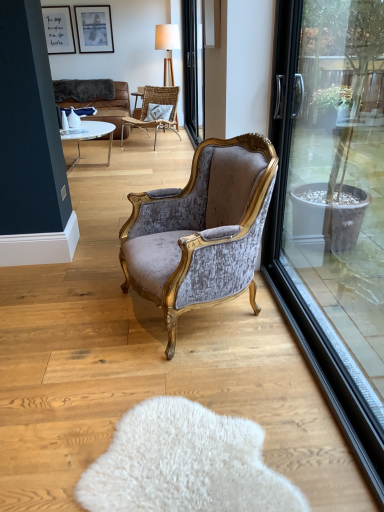
Question: Visually, is matte black picture frame at upper center, the 1th picture frame in the right-to-left sequence, positioned to the left or to the right of white glossy vase at upper left, acting as the second vase starting from the back?

Choices:
 (A) right
 (B) left

Answer: (B)

Question: Is matte black picture frame at upper center, the 1th picture frame in the right-to-left sequence, inside the boundaries of white glossy vase at upper left, acting as the second vase starting from the back, or outside?

Choices:
 (A) inside
 (B) outside

Answer: (B)

Question: Estimate the real-world distances between objects in this image. Which object is farther from the white glossy vase at center, marked as the 1th vase in a back-to-front arrangement?

Choices:
 (A) transparent glass door at right
 (B) matte black picture frame at upper left, the 1th picture frame viewed from the left
 (C) white glossy vase at upper left, acting as the second vase starting from the back
 (D) wooden textured lamp at upper center
 (E) dark brown leather couch at upper left

Answer: (A)

Question: Which object is positioned closest to the white glossy vase at upper left, acting as the second vase starting from the back?

Choices:
 (A) transparent glass door at right
 (B) white fluffy rug at lower center
 (C) dark brown leather couch at upper left
 (D) white glass coffee table at center
 (E) textured gray pillow at center

Answer: (D)